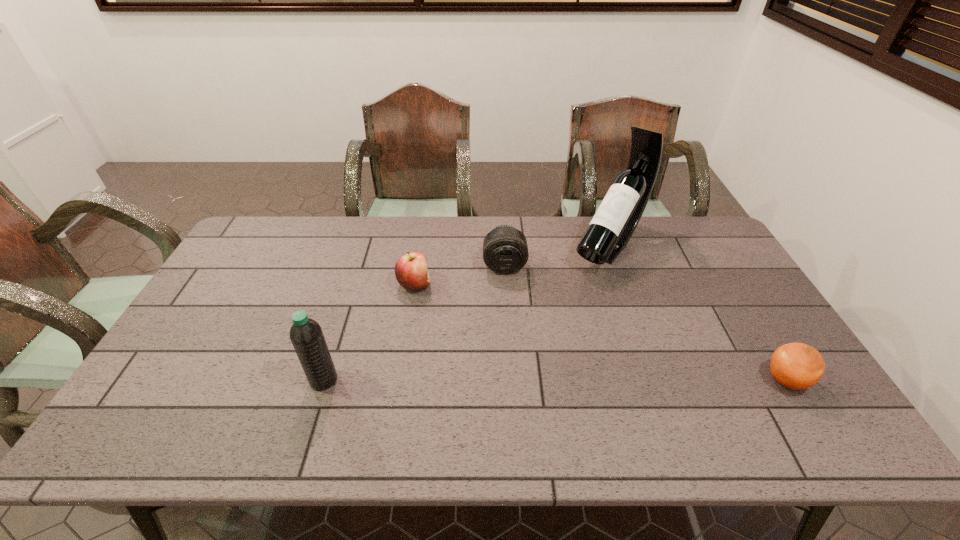
Where is `free space that is in between the telephoto lens and the leftmost object`? free space that is in between the telephoto lens and the leftmost object is located at coordinates (414, 323).

Select which object appears as the third closest to the orange. Please provide its 2D coordinates. Your answer should be formatted as a tuple, i.e. [(x, y)], where the tuple contains the x and y coordinates of a point satisfying the conditions above.

[(411, 270)]

I want to click on object that can be found as the fourth closest to the orange, so click(306, 335).

At what (x,y) coordinates should I click in order to perform the action: click on vacant space that satisfies the following two spatial constraints: 1. on the front side of the leftmost object; 2. on the right side of the rightmost object. Please return your answer as a coordinate pair (x, y). Looking at the image, I should click on (324, 380).